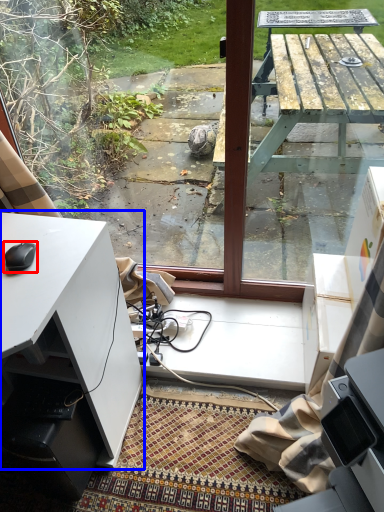
Question: Which point is closer to the camera, mouse (highlighted by a red box) or desk (highlighted by a blue box)?

Choices:
 (A) mouse
 (B) desk

Answer: (B)